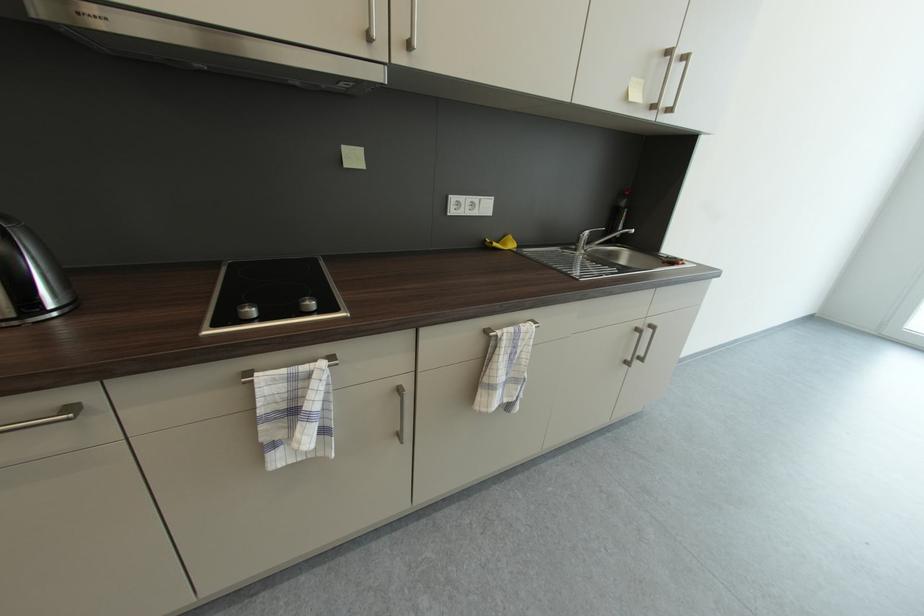
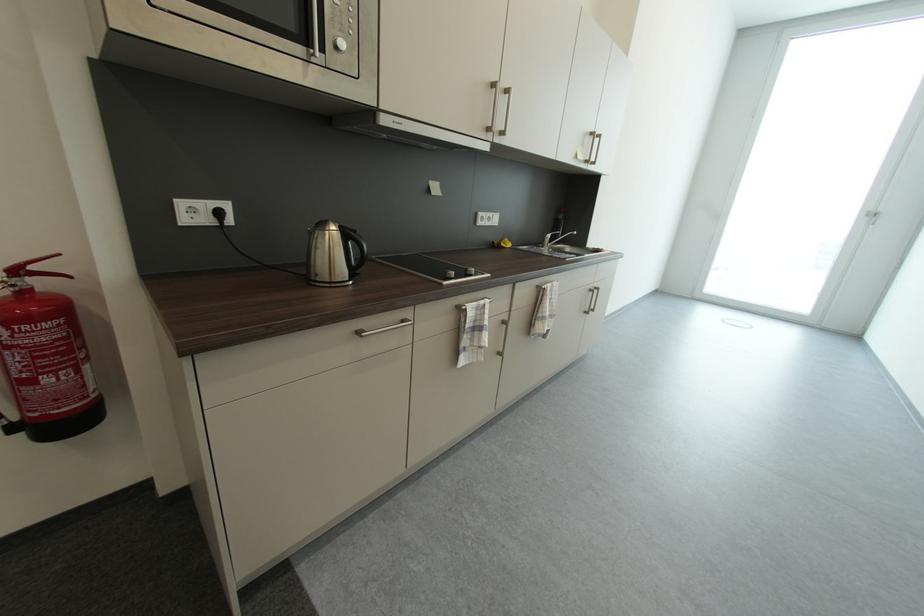
Locate, in the second image, the point that corresponds to (637,100) in the first image.

(585, 160)